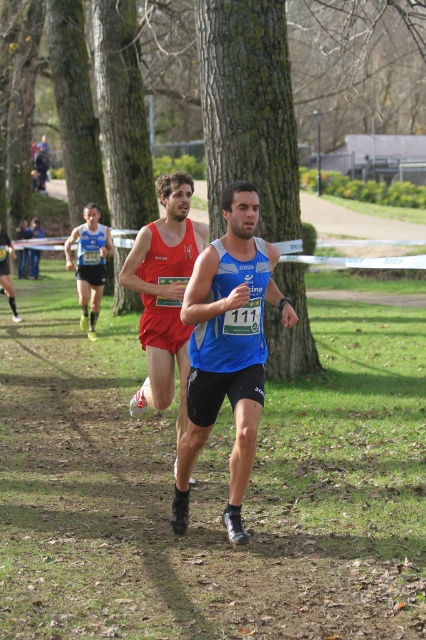
You are a race official trying to determine the current position of the runners. Looking at the image, which runner, the matte red singlet at center or the matte red singlet at left, is leading the race?

The matte red singlet at center is in front of the matte red singlet at left, so the matte red singlet at center is leading the race.

You are a photographer at the cross country race. You need to place a camera at point (x=249, y=109). What object will the camera be placed on?

The point (x=249, y=109) is on the green mossy tree at center, so the camera will be placed on the green mossy tree at center.

You are a race official trying to identify the leading runner in the cross country race. The race course is marked by a point at coordinates [164,292]. According to the scene, which runner is positioned at the center of the race course?

The point at coordinates [164,292] marks the matte red singlet at center, so the runner in the red singlet is positioned at the center of the race course.